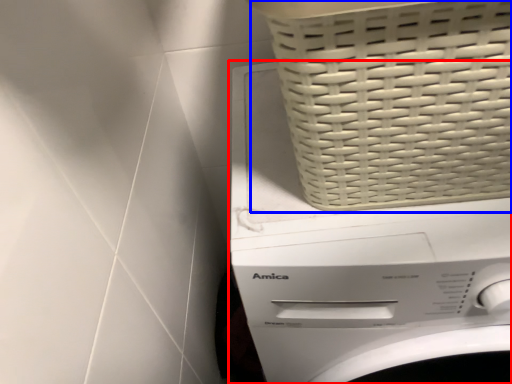
Question: Which point is further to the camera, washing machine (highlighted by a red box) or basket (highlighted by a blue box)?

Choices:
 (A) washing machine
 (B) basket

Answer: (A)